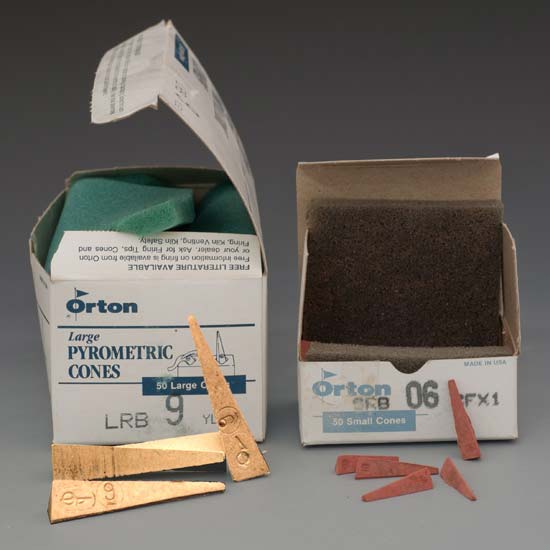
Identify the location of brown sponge. (409, 292).